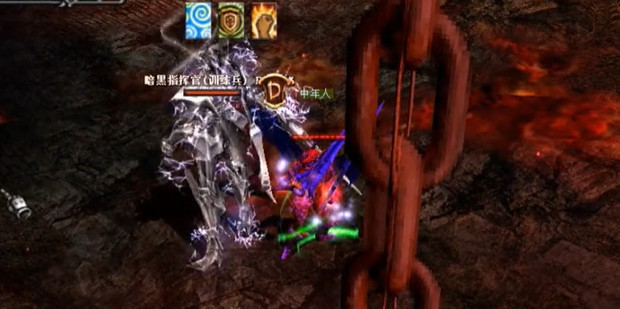
You are a GUI agent. You are given a task and a screenshot of the screen. Output one action in this format:
    pyautogui.click(x=<x>, y=<y>)
    Task: Click on the green lights
    The width and height of the screenshot is (620, 309).
    Given the screenshot: What is the action you would take?
    pyautogui.click(x=278, y=239), pyautogui.click(x=298, y=232), pyautogui.click(x=310, y=225), pyautogui.click(x=298, y=245), pyautogui.click(x=312, y=238), pyautogui.click(x=328, y=233), pyautogui.click(x=339, y=233), pyautogui.click(x=355, y=233)